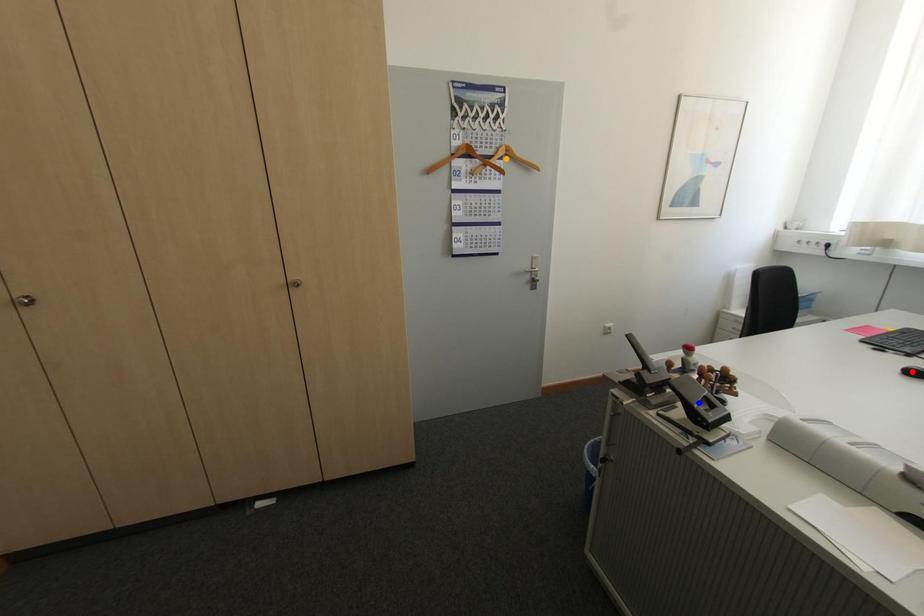
Consider the image. Order these from farthest to nearest:
A) blue point
B) orange point
C) red point

1. orange point
2. red point
3. blue point